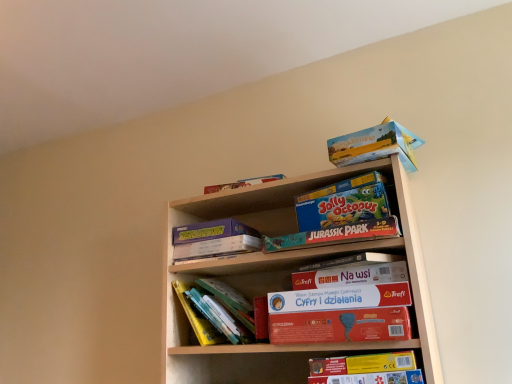
Question: Which direction should I rotate to look at hardcover books at center, the first book positioned from the back?

Choices:
 (A) left
 (B) right

Answer: (A)

Question: Is teal matte jurassic park puzzle at center, the second paperback book in the top-to-bottom sequence, positioned with its back to hardcover books at center, placed as the 2th book when sorted from right to left?

Choices:
 (A) no
 (B) yes

Answer: (A)

Question: Is teal matte jurassic park puzzle at center, the second paperback book in the top-to-bottom sequence, wider than hardcover books at center, which is the first book from left to right?

Choices:
 (A) no
 (B) yes

Answer: (B)

Question: Would you say hardcover books at center, acting as the 2th book starting from the front, is part of teal matte jurassic park puzzle at center, the second paperback book in the top-to-bottom sequence,'s contents?

Choices:
 (A) yes
 (B) no

Answer: (B)

Question: Considering the relative sizes of teal matte jurassic park puzzle at center, the second paperback book in the top-to-bottom sequence, and hardcover books at center, acting as the 2th book starting from the front, in the image provided, is teal matte jurassic park puzzle at center, the second paperback book in the top-to-bottom sequence, thinner than hardcover books at center, acting as the 2th book starting from the front,?

Choices:
 (A) yes
 (B) no

Answer: (B)

Question: From the image's perspective, is teal matte jurassic park puzzle at center, the second paperback book in the top-to-bottom sequence, located beneath hardcover books at center, placed as the 2th book when sorted from right to left?

Choices:
 (A) no
 (B) yes

Answer: (A)

Question: Can you confirm if teal matte jurassic park puzzle at center, which ranks as the fourth paperback book in bottom-to-top order, is shorter than hardcover books at center, the first book positioned from the back?

Choices:
 (A) yes
 (B) no

Answer: (A)

Question: From the image's perspective, is matte purple book at upper center, marked as the 3th paperback book in a bottom-to-top arrangement, located above hardcover books at center, which is the first book from left to right?

Choices:
 (A) yes
 (B) no

Answer: (A)

Question: Could you tell me if matte purple book at upper center, marked as the 3th paperback book in a bottom-to-top arrangement, is facing hardcover books at center, which is the first book from left to right?

Choices:
 (A) yes
 (B) no

Answer: (B)

Question: From a real-world perspective, is matte purple book at upper center, positioned as the 3th paperback book in top-to-bottom order, positioned over hardcover books at center, placed as the 2th book when sorted from right to left, based on gravity?

Choices:
 (A) yes
 (B) no

Answer: (A)

Question: Are matte purple book at upper center, positioned as the 3th paperback book in top-to-bottom order, and hardcover books at center, placed as the 2th book when sorted from right to left, far apart?

Choices:
 (A) yes
 (B) no

Answer: (B)

Question: Is matte purple book at upper center, positioned as the 3th paperback book in top-to-bottom order, next to hardcover books at center, placed as the 2th book when sorted from right to left, and touching it?

Choices:
 (A) no
 (B) yes

Answer: (A)

Question: Is matte purple book at upper center, marked as the 3th paperback book in a bottom-to-top arrangement, at the left side of hardcover books at center, the first book positioned from the back?

Choices:
 (A) no
 (B) yes

Answer: (B)

Question: Is matte cardboard box at upper right oriented away from blue cardboard jolly octopus board game at center, which appears as the 5th paperback book when ordered from the bottom?

Choices:
 (A) yes
 (B) no

Answer: (B)